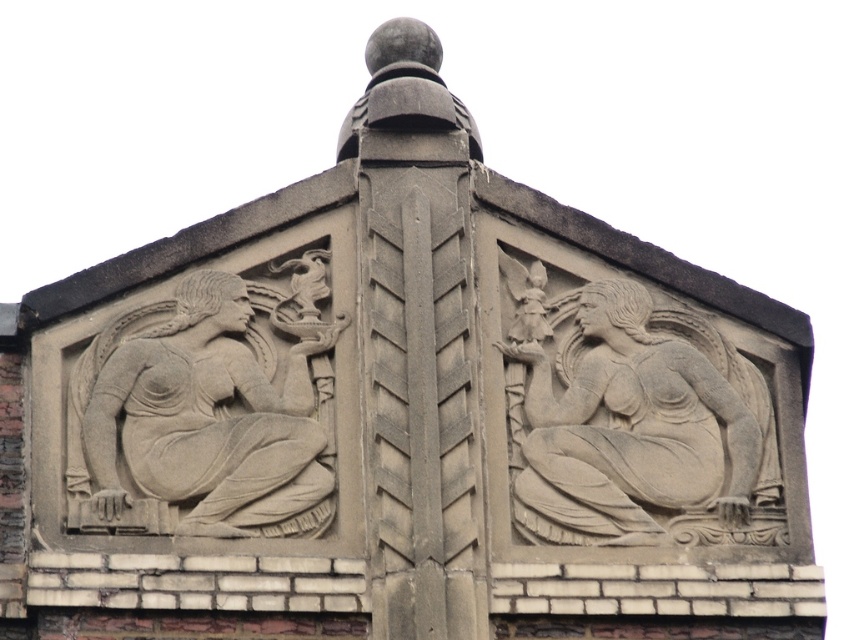
You are an architect examining the building details. You notice the gray stone angel at upper right and the gray stone sculpture at left. Which one is positioned lower in the structure?

The gray stone angel at upper right is positioned lower than the gray stone sculpture at left because it is described as being below it.

You are an architect examining the relief sculptures on the building. You notice two points marked on the image at coordinates point (554, 538) and point (120, 392). Which point is closer to the viewer?

Point (554, 538) is in front of point (120, 392), so it is closer to the viewer.